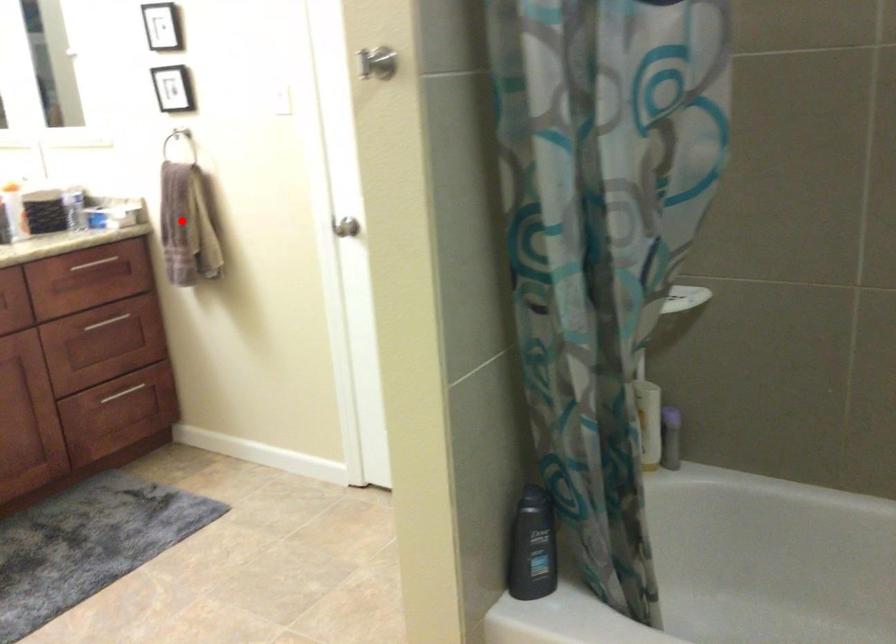
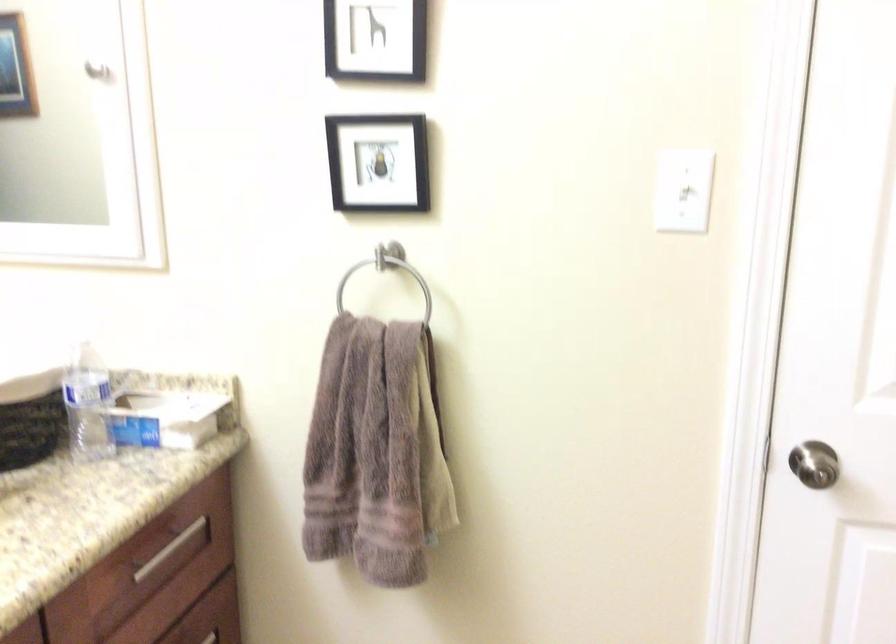
Question: I am providing you with two images of the same scene from different viewpoints. A red point is shown in image1. For the corresponding object point in image2, is it positioned nearer or farther from the camera?

Choices:
 (A) Nearer
 (B) Farther

Answer: (A)